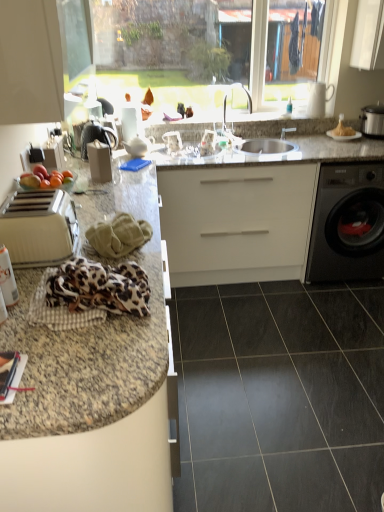
In order to click on free spot above dark gray polished granite at center (from a real-world perspective) in this screenshot , I will do `click(301, 354)`.